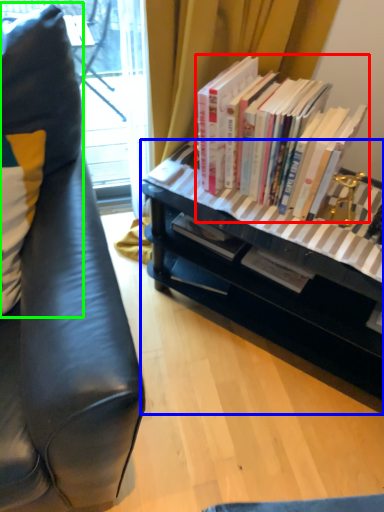
Question: Estimate the real-world distances between objects in this image. Which object is farther from book (highlighted by a red box), desk (highlighted by a blue box) or pillow (highlighted by a green box)?

Choices:
 (A) desk
 (B) pillow

Answer: (B)